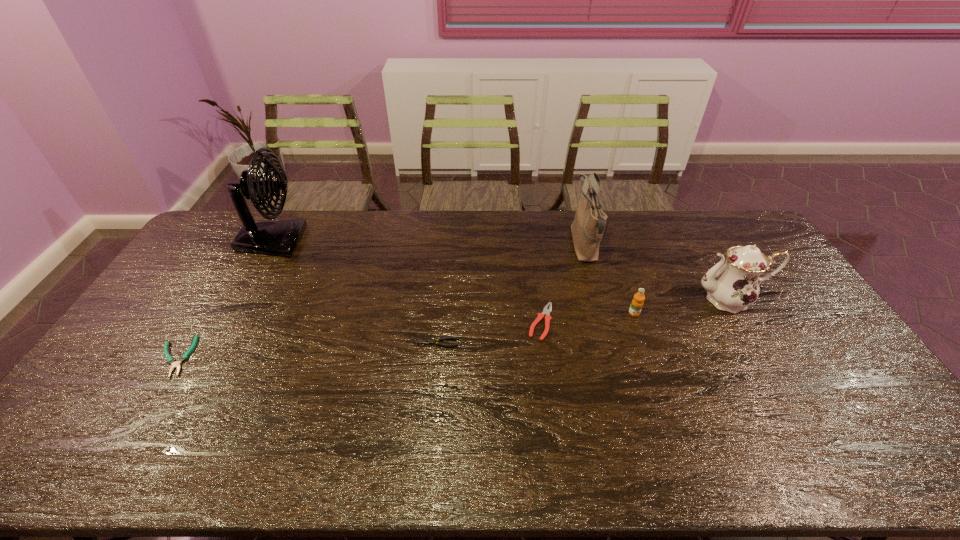
Locate an element on the screen. The image size is (960, 540). free space at the left edge of the desktop is located at coordinates (229, 251).

The image size is (960, 540). Find the location of `vacant space at the right edge`. vacant space at the right edge is located at coordinates (764, 313).

In the image, there is a desktop. Where is `blank space at the near left corner`? This screenshot has height=540, width=960. blank space at the near left corner is located at coordinates (50, 451).

I want to click on vacant point located between the shoulder bag and the rightmost pliers, so click(563, 284).

Find the location of `vacant area that lies between the sixth shortest object and the third tallest object`. vacant area that lies between the sixth shortest object and the third tallest object is located at coordinates (657, 273).

Find the location of a particular element. vacant space that is in between the sixth object from left to right and the rightmost pliers is located at coordinates (588, 318).

The height and width of the screenshot is (540, 960). I want to click on unoccupied area between the third shortest object and the shortest object, so click(x=357, y=339).

Image resolution: width=960 pixels, height=540 pixels. In order to click on vacant point located between the shortest object and the fan in this screenshot , I will do `click(224, 299)`.

Image resolution: width=960 pixels, height=540 pixels. I want to click on vacant region between the sixth shortest object and the third tallest object, so click(x=657, y=273).

Where is `vacant space that's between the second shortest object and the third shortest object`? The height and width of the screenshot is (540, 960). vacant space that's between the second shortest object and the third shortest object is located at coordinates (489, 333).